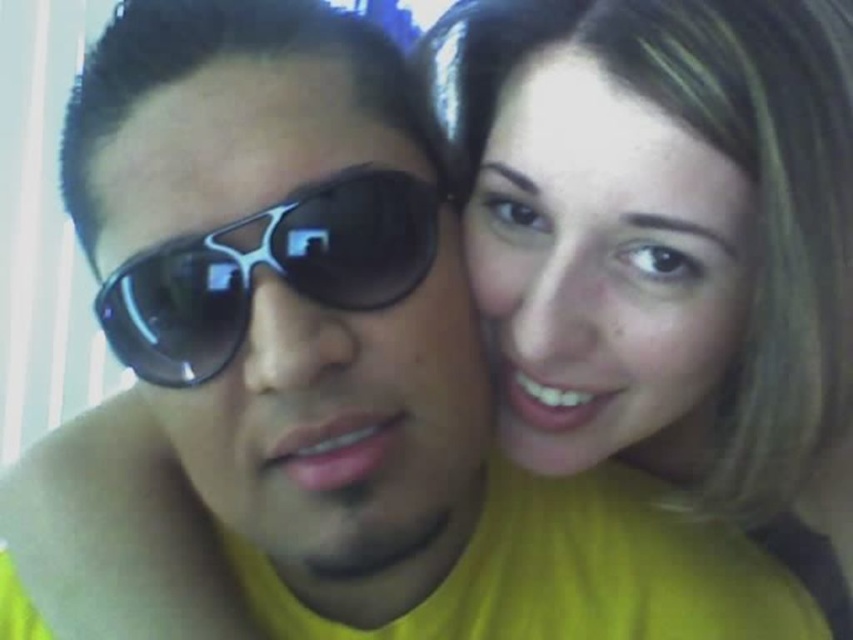
Question: Can you confirm if matte yellow shirt at upper right is positioned to the right of black plastic sunglasses at left?

Choices:
 (A) no
 (B) yes

Answer: (B)

Question: Which point is closer to the camera?

Choices:
 (A) matte yellow shirt at upper right
 (B) black plastic sunglasses at left

Answer: (B)

Question: From the image, what is the correct spatial relationship of matte yellow shirt at upper right in relation to black plastic sunglasses at left?

Choices:
 (A) below
 (B) above

Answer: (A)

Question: Is matte yellow shirt at upper right wider than black plastic sunglasses at left?

Choices:
 (A) no
 (B) yes

Answer: (B)

Question: Which point appears farthest from the camera in this image?

Choices:
 (A) (117, 298)
 (B) (820, 186)

Answer: (B)